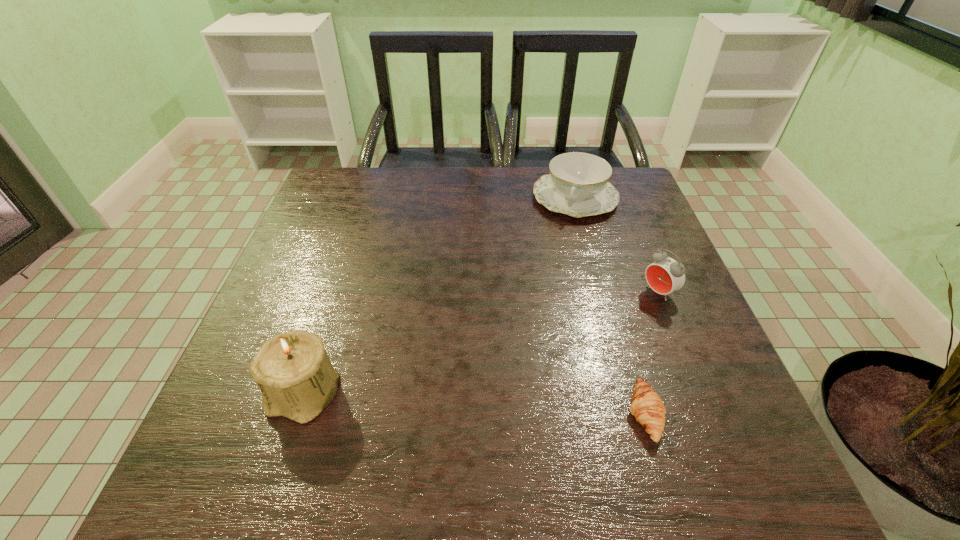
Identify the location of blank space located on the front-facing side of the pastry. (502, 414).

At what (x,y) coordinates should I click in order to perform the action: click on free space located on the face of the alarm clock. Please return your answer as a coordinate pair (x, y). The image size is (960, 540). Looking at the image, I should click on (609, 323).

Locate an element on the screen. free spot located 0.300m on the face of the alarm clock is located at coordinates (542, 363).

Where is `vacant space located 0.370m on the face of the alarm clock`? This screenshot has width=960, height=540. vacant space located 0.370m on the face of the alarm clock is located at coordinates (514, 381).

Where is `vacant space located on the handle side of the farthest object`? This screenshot has height=540, width=960. vacant space located on the handle side of the farthest object is located at coordinates (537, 309).

Find the location of a particular element. vacant space located on the handle side of the farthest object is located at coordinates (534, 319).

What are the coordinates of `free space located 0.080m on the handle side of the farthest object` in the screenshot? It's located at (561, 240).

You are a GUI agent. You are given a task and a screenshot of the screen. Output one action in this format:
    pyautogui.click(x=<x>, y=<y>)
    Task: Click on the object positioned at the far edge
    
    Given the screenshot: What is the action you would take?
    pyautogui.click(x=578, y=185)

Locate an element on the screen. candle_holder that is positioned at the near edge is located at coordinates (292, 369).

Image resolution: width=960 pixels, height=540 pixels. Identify the location of pastry present at the near edge. (646, 405).